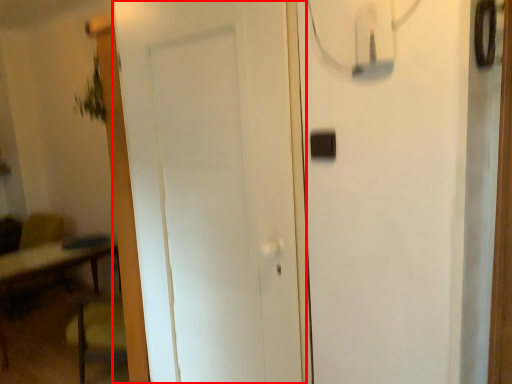
Question: Where is door (annotated by the red box) located in relation to light switch in the image?

Choices:
 (A) right
 (B) left

Answer: (B)